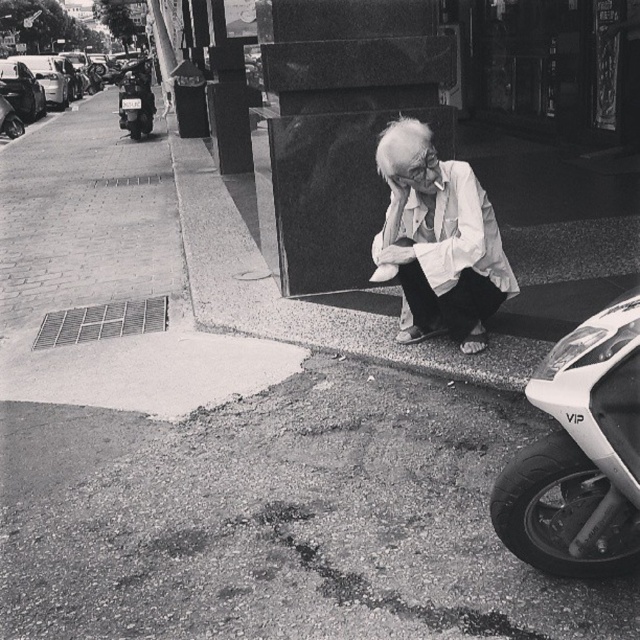
Question: Which object is the closest to the shiny black motorcycle at left?

Choices:
 (A) white glossy motorcycle at lower right
 (B) white wrinkled shirt at lower right

Answer: (B)

Question: Is white wrinkled shirt at lower right to the right of shiny black motorcycle at left from the viewer's perspective?

Choices:
 (A) yes
 (B) no

Answer: (A)

Question: Does white wrinkled shirt at lower right have a lesser width compared to shiny black motorcycle at left?

Choices:
 (A) no
 (B) yes

Answer: (B)

Question: Is white wrinkled shirt at lower right positioned before shiny black motorcycle at left?

Choices:
 (A) no
 (B) yes

Answer: (B)

Question: Considering the real-world distances, which object is closest to the white glossy motorcycle at lower right?

Choices:
 (A) shiny black motorcycle at left
 (B) white wrinkled shirt at lower right

Answer: (B)

Question: Among these objects, which one is nearest to the camera?

Choices:
 (A) shiny black motorcycle at left
 (B) white wrinkled shirt at lower right
 (C) white glossy motorcycle at lower right

Answer: (C)